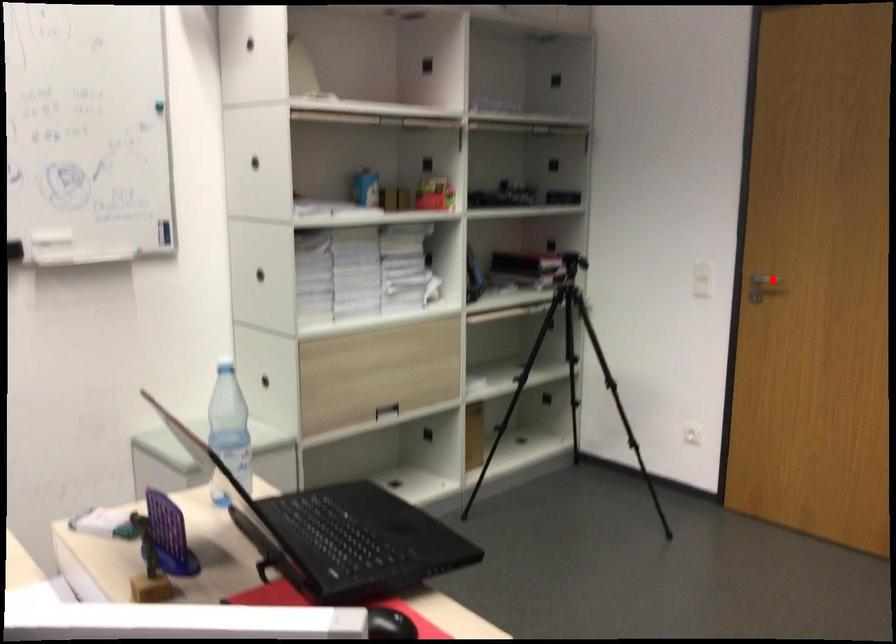
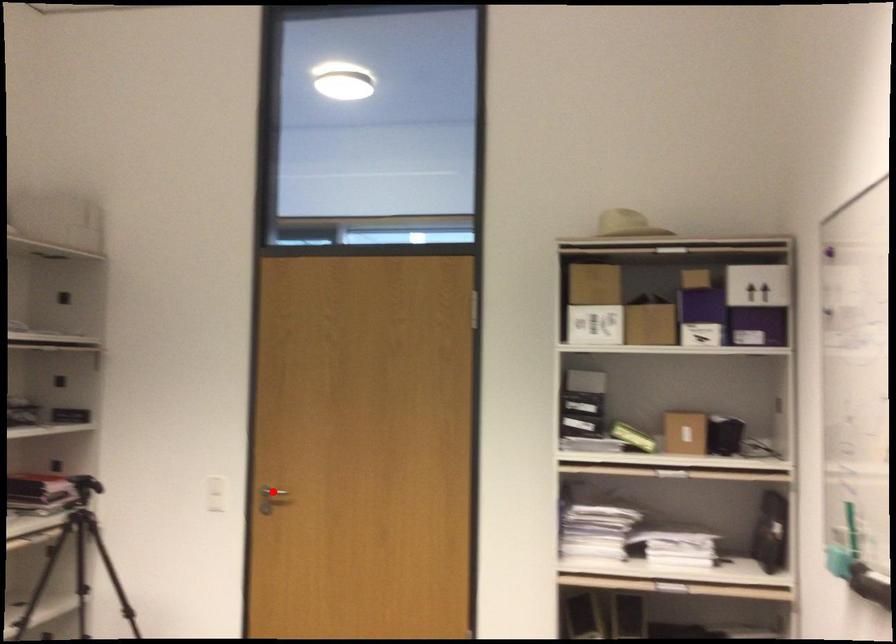
I am providing you with two images of the same scene from different viewpoints. A red point is marked on the first image and another point is marked on the second image. Is the marked point in image1 the same physical position as the marked point in image2?

Yes